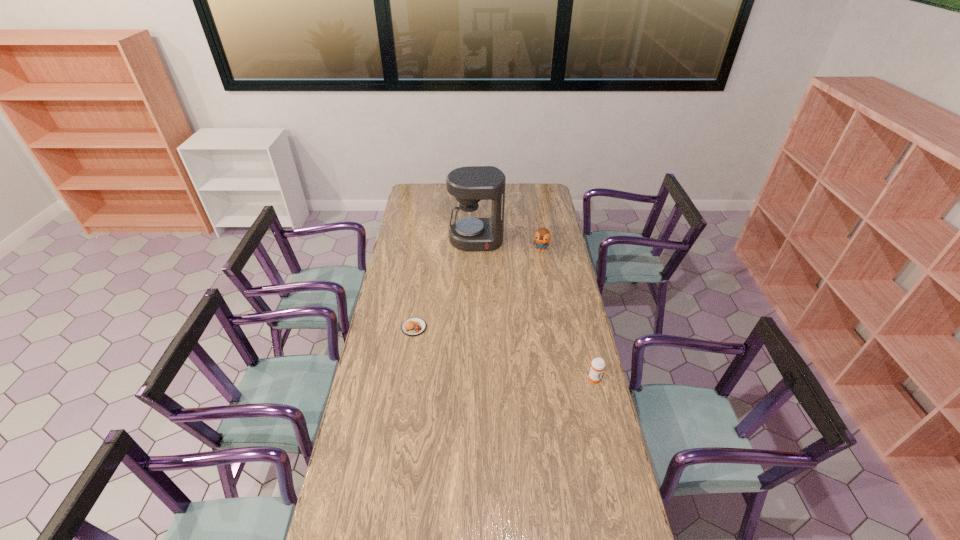
Find the location of a particular element. This screenshot has width=960, height=540. the second nearest object is located at coordinates (414, 326).

The width and height of the screenshot is (960, 540). Find the location of `the shortest object`. the shortest object is located at coordinates (414, 326).

Where is `the second shortest object`? The width and height of the screenshot is (960, 540). the second shortest object is located at coordinates 597,365.

Where is `the rightmost object`? The height and width of the screenshot is (540, 960). the rightmost object is located at coordinates point(597,365).

You are a GUI agent. You are given a task and a screenshot of the screen. Output one action in this format:
    pyautogui.click(x=<x>, y=<y>)
    Task: Click on the third shortest object
    This screenshot has height=540, width=960.
    Given the screenshot: What is the action you would take?
    pyautogui.click(x=542, y=236)

The height and width of the screenshot is (540, 960). I want to click on the third object from left to right, so click(542, 236).

Where is `the tallest object`? The height and width of the screenshot is (540, 960). the tallest object is located at coordinates (471, 232).

Where is `the third object from right to left`? the third object from right to left is located at coordinates (471, 232).

You are a GUI agent. You are given a task and a screenshot of the screen. Output one action in this format:
    pyautogui.click(x=<x>, y=<y>)
    Task: Click on the free space located on the back of the patty
    
    Given the screenshot: What is the action you would take?
    pyautogui.click(x=422, y=269)

Identify the location of vacant space located on the back of the rightmost object. (581, 326).